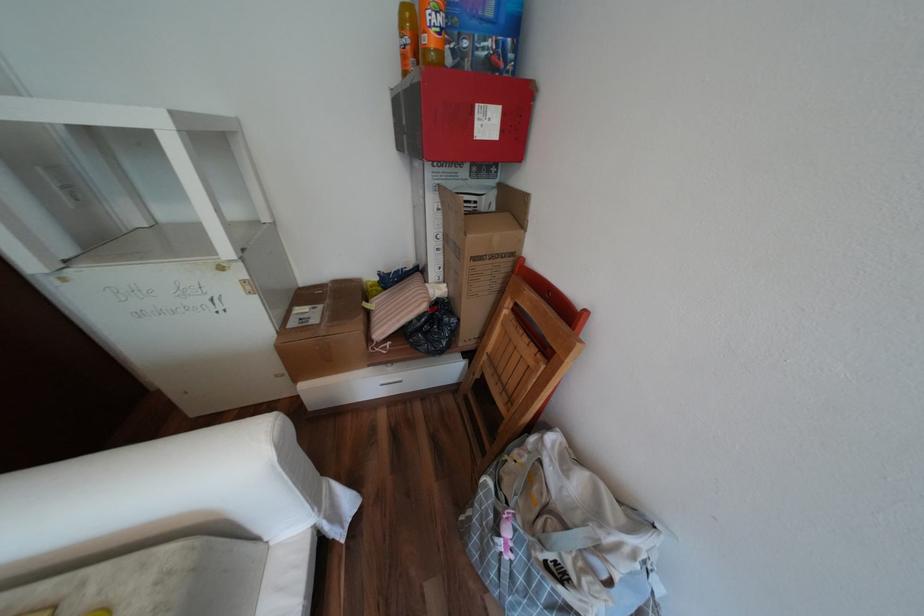
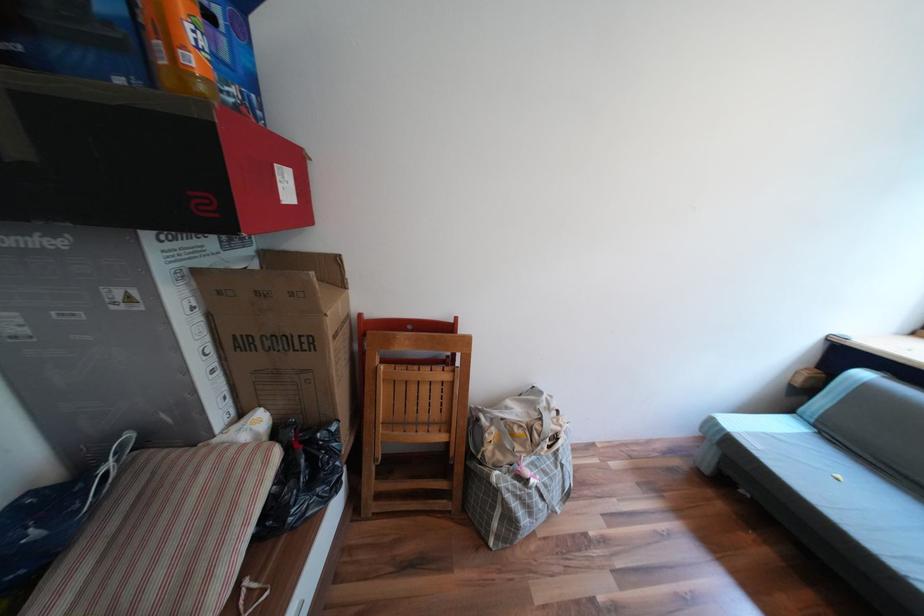
In the second image, find the point that corresponds to the point at 450,237 in the first image.

(219, 349)